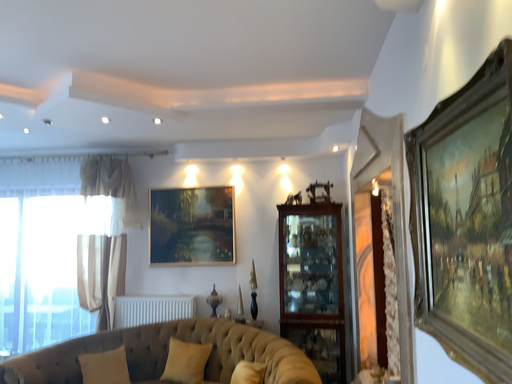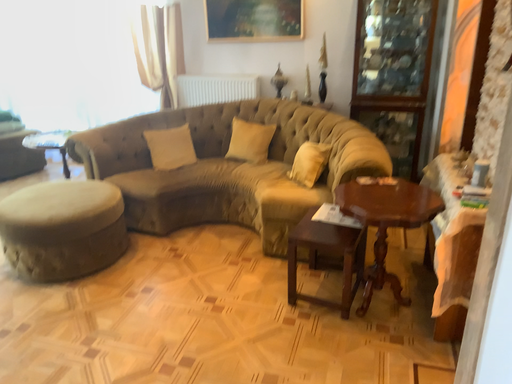
Question: How did the camera likely rotate when shooting the video?

Choices:
 (A) rotated right
 (B) rotated left

Answer: (B)